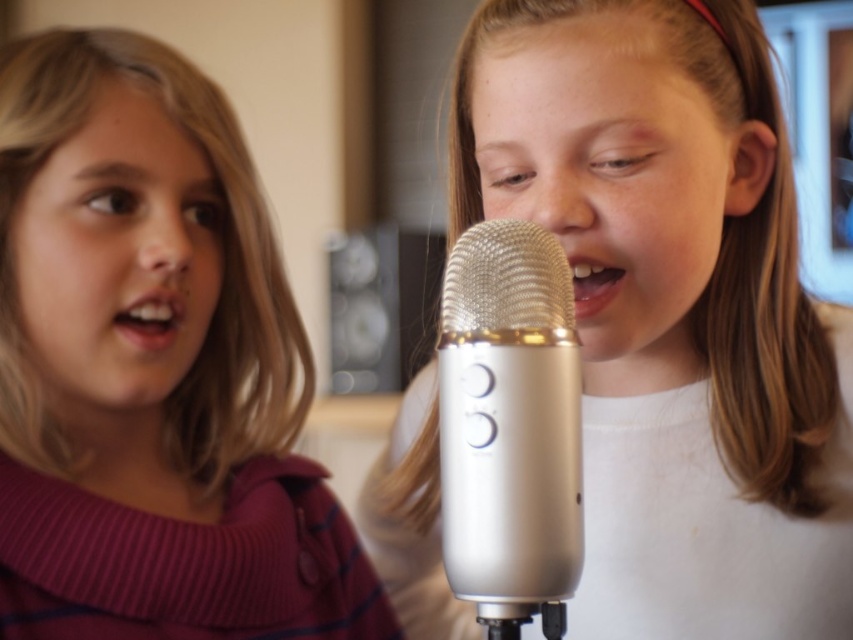
Can you confirm if white matte microphone at center is positioned to the left of silver metallic microphone at center?

No, white matte microphone at center is not to the left of silver metallic microphone at center.

Does white matte microphone at center have a lesser height compared to silver metallic microphone at center?

No.

You are a GUI agent. You are given a task and a screenshot of the screen. Output one action in this format:
    pyautogui.click(x=<x>, y=<y>)
    Task: Click on the white matte microphone at center
    This screenshot has width=853, height=640.
    Given the screenshot: What is the action you would take?
    pyautogui.click(x=672, y=307)

Can you confirm if matte pink sweater at left is positioned below silver metallic microphone at center?

Incorrect, matte pink sweater at left is not positioned below silver metallic microphone at center.

Measure the distance from matte pink sweater at left to silver metallic microphone at center.

A distance of 13.89 inches exists between matte pink sweater at left and silver metallic microphone at center.

Describe the element at coordinates (152, 368) in the screenshot. The height and width of the screenshot is (640, 853). I see `matte pink sweater at left` at that location.

Locate an element on the screen. This screenshot has width=853, height=640. matte pink sweater at left is located at coordinates (152, 368).

In the scene shown: Who is taller, white matte microphone at center or matte pink sweater at left?

white matte microphone at center is taller.

Is point (547, 132) less distant than point (132, 552)?

Yes, point (547, 132) is in front of point (132, 552).

Locate an element on the screen. The image size is (853, 640). white matte microphone at center is located at coordinates (672, 307).